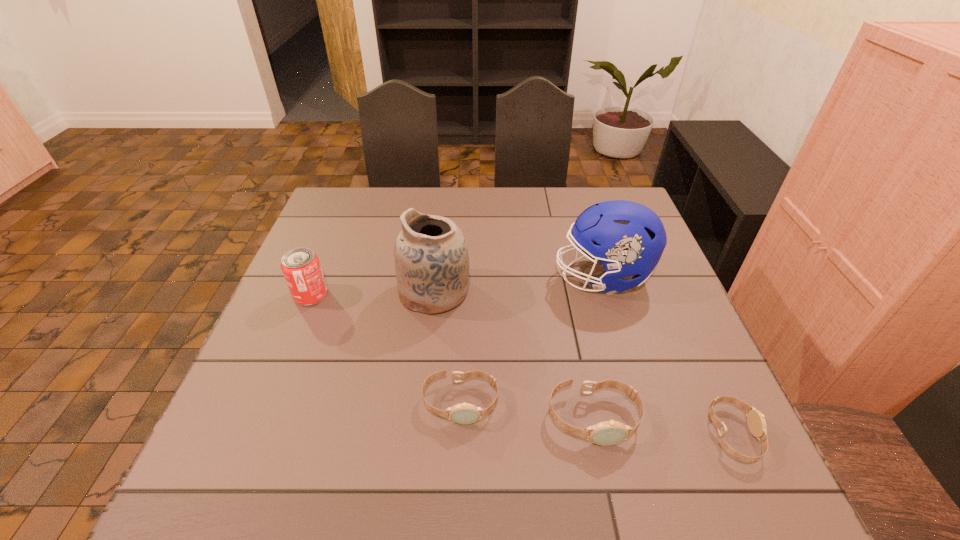
Please point out where to position a new watch on the left to maintain spacing. Please provide its 2D coordinates. Your answer should be formatted as a tuple, i.e. [(x, y)], where the tuple contains the x and y coordinates of a point satisfying the conditions above.

[(336, 387)]